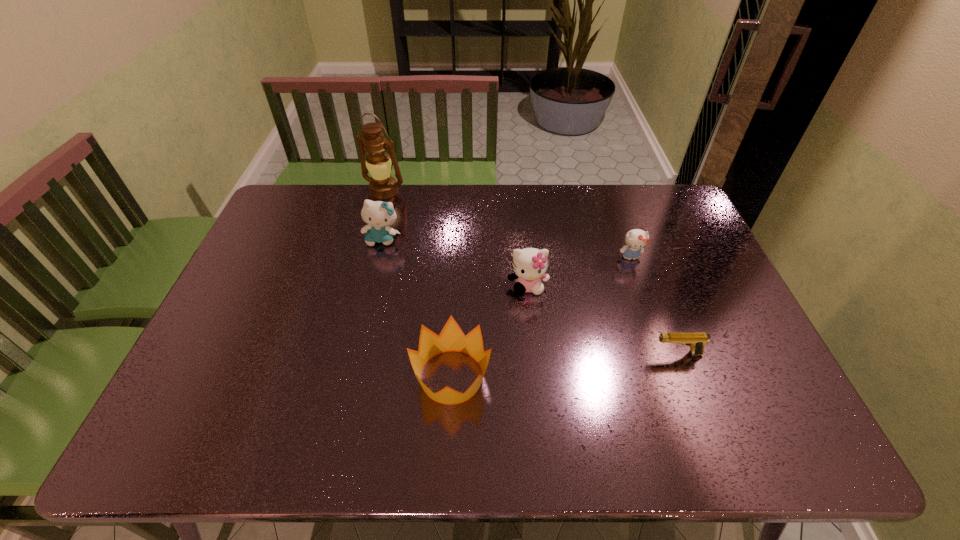
Identify the location of vacant space in between the second nearest kitten and the oil lamp. This screenshot has width=960, height=540. (508, 224).

At what (x,y) coordinates should I click in order to perform the action: click on vacant space that is in between the third nearest object and the tallest object. Please return your answer as a coordinate pair (x, y). The height and width of the screenshot is (540, 960). Looking at the image, I should click on (456, 239).

Identify the location of object identified as the fifth closest to the oil lamp. Image resolution: width=960 pixels, height=540 pixels. (696, 340).

Find the location of a particular element. The height and width of the screenshot is (540, 960). object that is the second closest to the farthest kitten is located at coordinates pos(529,264).

Locate an element on the screen. the third closest kitten to the oil lamp is located at coordinates pos(636,239).

I want to click on kitten identified as the closest to the third object from left to right, so click(x=529, y=264).

The width and height of the screenshot is (960, 540). I want to click on free spot that satisfies the following two spatial constraints: 1. on the face of the fourth object from right to left; 2. on the left side of the farthest kitten, so click(x=350, y=377).